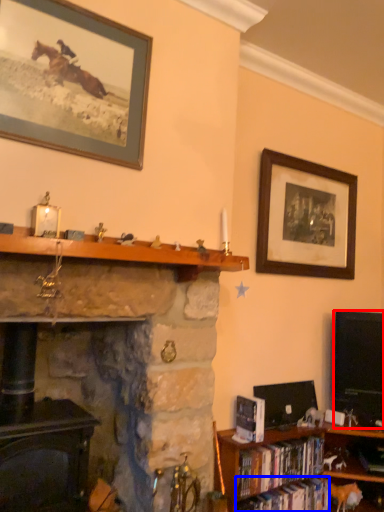
Question: Which point is further to the camera, television (highlighted by a red box) or book (highlighted by a blue box)?

Choices:
 (A) television
 (B) book

Answer: (A)